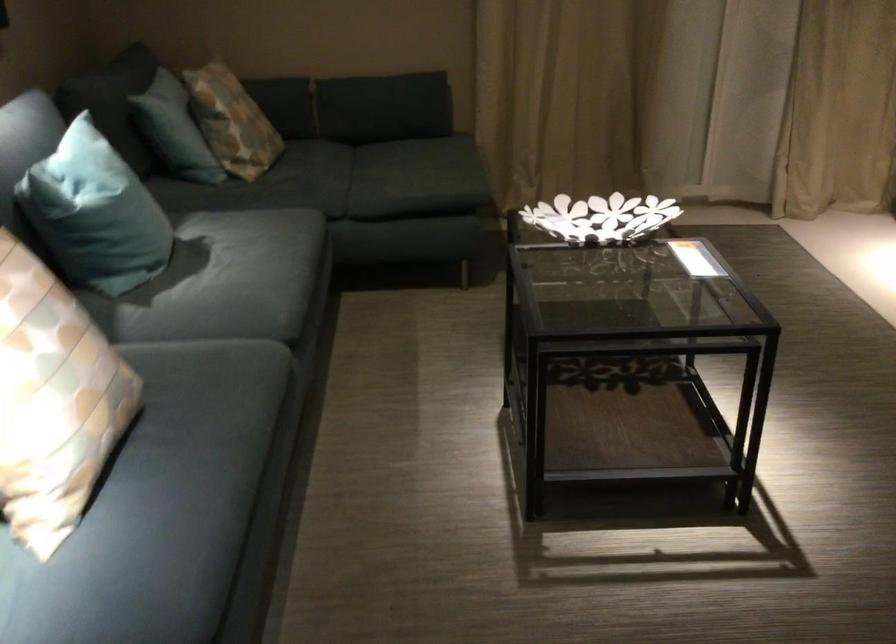
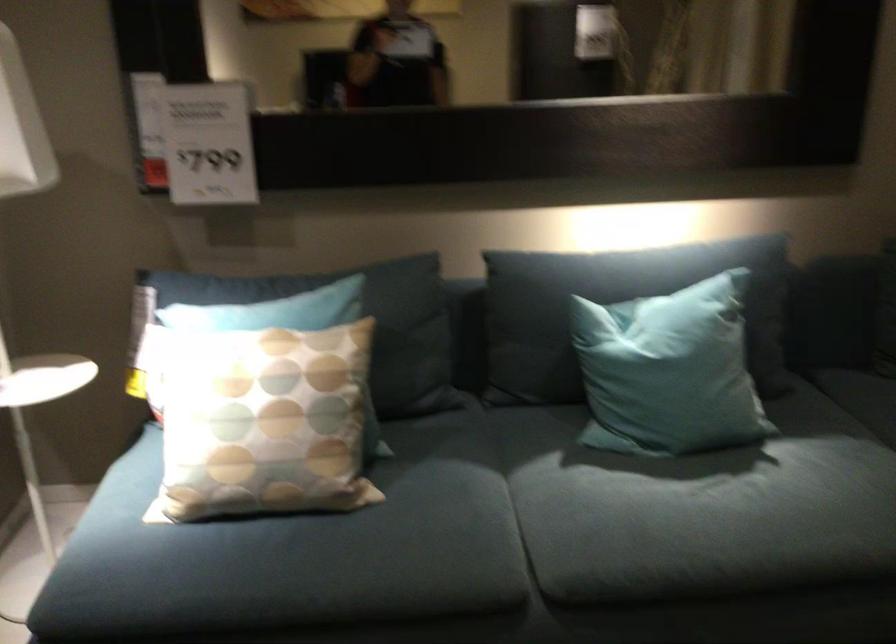
Find the pixel in the second image that matches (x=202, y=374) in the first image.

(406, 526)